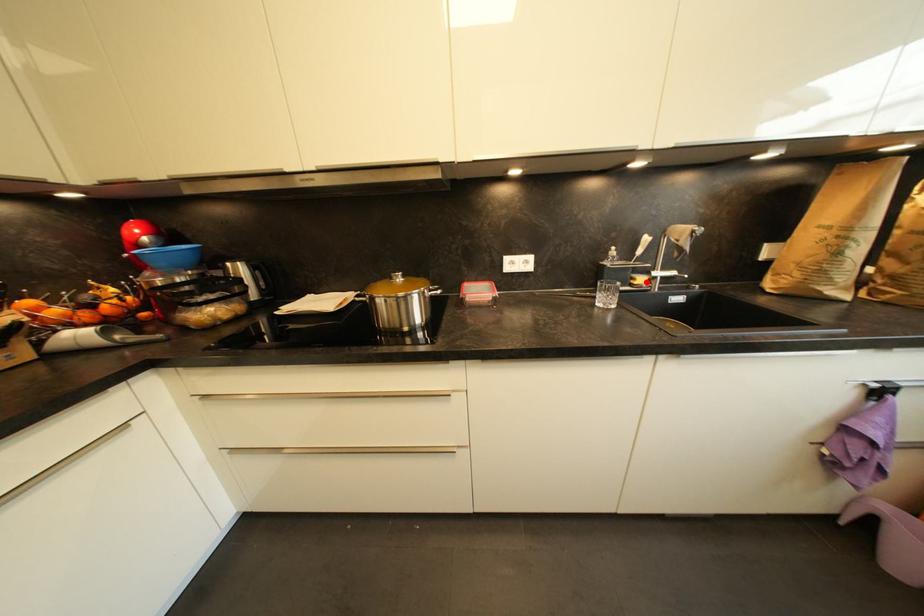
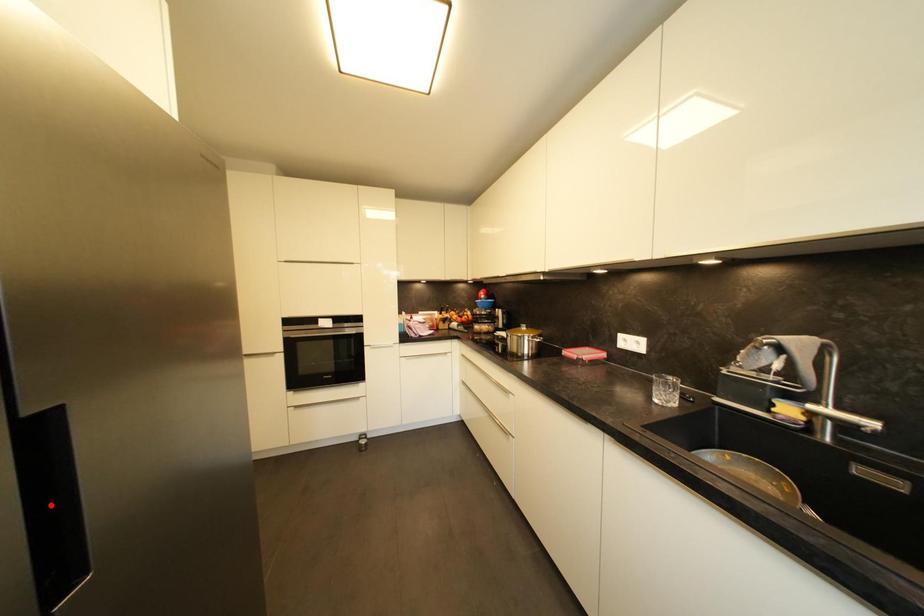
I am providing you with two images of the same scene from different viewpoints. A red point is marked on the first image and another point is marked on the second image. Does the point marked in image1 correspond to the same location as the one in image2?

No